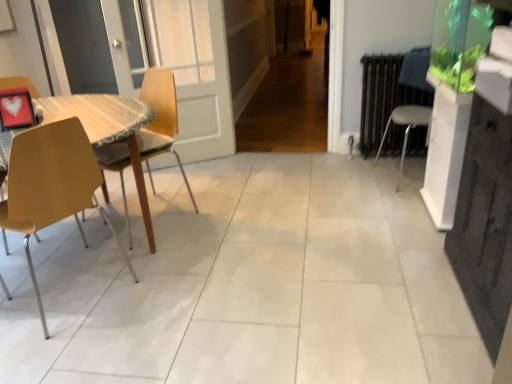
At what (x,y) coordinates should I click in order to perform the action: click on wooden at left, the 2th chair in the left-to-right sequence. Please return your answer as a coordinate pair (x, y). The width and height of the screenshot is (512, 384). Looking at the image, I should click on (160, 120).

At what (x,y) coordinates should I click in order to perform the action: click on wooden at left, the 2th chair in the left-to-right sequence. Please return your answer as a coordinate pair (x, y). This screenshot has width=512, height=384. Looking at the image, I should click on (160, 120).

From a real-world perspective, relative to wooden at left, arranged as the second chair when viewed from the right, is matte yellow chair at left, the 3th chair viewed from the right, vertically above or below?

matte yellow chair at left, the 3th chair viewed from the right, is situated higher than wooden at left, arranged as the second chair when viewed from the right, in the real world.

How different are the orientations of matte yellow chair at left, the 3th chair viewed from the right, and wooden at left, the 2th chair in the left-to-right sequence, in degrees?

They differ by 85.2 degrees in their facing directions.

Is matte yellow chair at left, placed as the 1th chair when sorted from left to right, smaller than wooden at left, the 2th chair in the left-to-right sequence?

Correct, matte yellow chair at left, placed as the 1th chair when sorted from left to right, occupies less space than wooden at left, the 2th chair in the left-to-right sequence.

Is matte yellow chair at left, the 3th chair viewed from the right, spatially inside wooden at left, arranged as the second chair when viewed from the right, or outside of it?

matte yellow chair at left, the 3th chair viewed from the right, lies outside wooden at left, arranged as the second chair when viewed from the right.

From a real-world perspective, is matte yellow chair at left, the 3th chair viewed from the right, beneath white plastic chair at right, arranged as the 1th chair when viewed from the right?

No, from a real-world perspective, matte yellow chair at left, the 3th chair viewed from the right, is not below white plastic chair at right, arranged as the 1th chair when viewed from the right.

Who is taller, matte yellow chair at left, placed as the 1th chair when sorted from left to right, or white plastic chair at right, arranged as the 1th chair when viewed from the right?

matte yellow chair at left, placed as the 1th chair when sorted from left to right, is taller.

There is a matte yellow chair at left, the 3th chair viewed from the right. Where is `the 2nd chair above it (from the image's perspective)`? The height and width of the screenshot is (384, 512). the 2nd chair above it (from the image's perspective) is located at coordinates (407, 126).

Between matte yellow chair at left, the 3th chair viewed from the right, and white plastic chair at right, arranged as the 3th chair when viewed from the left, which one appears on the right side from the viewer's perspective?

white plastic chair at right, arranged as the 3th chair when viewed from the left, is more to the right.

Which object is wider, wooden at left, arranged as the second chair when viewed from the right, or matte yellow chair at left, placed as the 1th chair when sorted from left to right?

wooden at left, arranged as the second chair when viewed from the right.

Could matte yellow chair at left, placed as the 1th chair when sorted from left to right, be considered to be inside wooden at left, arranged as the second chair when viewed from the right?

That's incorrect, matte yellow chair at left, placed as the 1th chair when sorted from left to right, is not inside wooden at left, arranged as the second chair when viewed from the right.

From the image's perspective, does wooden at left, arranged as the second chair when viewed from the right, appear lower than matte yellow chair at left, placed as the 1th chair when sorted from left to right?

No, from the image's perspective, wooden at left, arranged as the second chair when viewed from the right, is not below matte yellow chair at left, placed as the 1th chair when sorted from left to right.

Is wooden at left, arranged as the second chair when viewed from the right, with white plastic chair at right, arranged as the 3th chair when viewed from the left?

No, wooden at left, arranged as the second chair when viewed from the right, is not making contact with white plastic chair at right, arranged as the 3th chair when viewed from the left.

Considering the sizes of objects wooden at left, arranged as the second chair when viewed from the right, and white plastic chair at right, arranged as the 1th chair when viewed from the right, in the image provided, who is taller, wooden at left, arranged as the second chair when viewed from the right, or white plastic chair at right, arranged as the 1th chair when viewed from the right,?

With more height is wooden at left, arranged as the second chair when viewed from the right.

Can you confirm if wooden at left, the 2th chair in the left-to-right sequence, is wider than white plastic chair at right, arranged as the 3th chair when viewed from the left?

Incorrect, the width of wooden at left, the 2th chair in the left-to-right sequence, does not surpass that of white plastic chair at right, arranged as the 3th chair when viewed from the left.

Does point (146, 96) appear closer or farther from the camera than point (400, 167)?

Point (146, 96) is closer to the camera than point (400, 167).

Is white plastic chair at right, arranged as the 1th chair when viewed from the right, positioned in front of matte yellow chair at left, the 3th chair viewed from the right?

No, white plastic chair at right, arranged as the 1th chair when viewed from the right, is further to the viewer.

From the picture: Which of these two, white plastic chair at right, arranged as the 3th chair when viewed from the left, or matte yellow chair at left, placed as the 1th chair when sorted from left to right, is wider?

Wider between the two is white plastic chair at right, arranged as the 3th chair when viewed from the left.

From a real-world perspective, is white plastic chair at right, arranged as the 3th chair when viewed from the left, positioned above or below matte yellow chair at left, placed as the 1th chair when sorted from left to right?

white plastic chair at right, arranged as the 3th chair when viewed from the left, is situated lower than matte yellow chair at left, placed as the 1th chair when sorted from left to right, in the real world.

Locate an element on the screen. the 2nd chair behind the matte yellow chair at left, placed as the 1th chair when sorted from left to right is located at coordinates (407, 126).

Does white plastic chair at right, arranged as the 3th chair when viewed from the left, turn towards wooden at left, the 2th chair in the left-to-right sequence?

A: Yes, white plastic chair at right, arranged as the 3th chair when viewed from the left, is oriented towards wooden at left, the 2th chair in the left-to-right sequence.

Considering the positions of point (415, 106) and point (176, 131), is point (415, 106) closer or farther from the camera than point (176, 131)?

Clearly, point (415, 106) is closer to the camera than point (176, 131).

Considering the sizes of objects white plastic chair at right, arranged as the 3th chair when viewed from the left, and wooden at left, arranged as the second chair when viewed from the right, in the image provided, who is wider, white plastic chair at right, arranged as the 3th chair when viewed from the left, or wooden at left, arranged as the second chair when viewed from the right,?

white plastic chair at right, arranged as the 3th chair when viewed from the left, is wider.

You are a GUI agent. You are given a task and a screenshot of the screen. Output one action in this format:
    pyautogui.click(x=<x>, y=<y>)
    Task: Click on the 1st chair positioned above the matte yellow chair at left, the 3th chair viewed from the right (from the image's perspective)
    This screenshot has width=512, height=384.
    Given the screenshot: What is the action you would take?
    pyautogui.click(x=160, y=120)

The width and height of the screenshot is (512, 384). In order to click on the 2nd chair to the left of the white plastic chair at right, arranged as the 3th chair when viewed from the left, counting from the anchor's position in this screenshot , I will do `click(51, 185)`.

Which object lies further to the anchor point white plastic chair at right, arranged as the 3th chair when viewed from the left, matte yellow chair at left, the 3th chair viewed from the right, or wooden at left, the 2th chair in the left-to-right sequence?

matte yellow chair at left, the 3th chair viewed from the right, is positioned further to the anchor white plastic chair at right, arranged as the 3th chair when viewed from the left.

Which object lies further to the anchor point matte yellow chair at left, the 3th chair viewed from the right, white plastic chair at right, arranged as the 1th chair when viewed from the right, or wooden at left, arranged as the second chair when viewed from the right?

Based on the image, white plastic chair at right, arranged as the 1th chair when viewed from the right, appears to be further to matte yellow chair at left, the 3th chair viewed from the right.

Looking at the image, which one is located closer to wooden at left, the 2th chair in the left-to-right sequence, matte yellow chair at left, the 3th chair viewed from the right, or white plastic chair at right, arranged as the 1th chair when viewed from the right?

matte yellow chair at left, the 3th chair viewed from the right.

Estimate the real-world distances between objects in this image. Which object is closer to matte yellow chair at left, the 3th chair viewed from the right, wooden at left, the 2th chair in the left-to-right sequence, or white plastic chair at right, arranged as the 1th chair when viewed from the right?

wooden at left, the 2th chair in the left-to-right sequence, is closer to matte yellow chair at left, the 3th chair viewed from the right.

Based on their spatial positions, is white plastic chair at right, arranged as the 3th chair when viewed from the left, or matte yellow chair at left, the 3th chair viewed from the right, further from wooden at left, arranged as the second chair when viewed from the right?

white plastic chair at right, arranged as the 3th chair when viewed from the left, is further to wooden at left, arranged as the second chair when viewed from the right.

Which object lies nearer to the anchor point white plastic chair at right, arranged as the 3th chair when viewed from the left, wooden at left, the 2th chair in the left-to-right sequence, or matte yellow chair at left, placed as the 1th chair when sorted from left to right?

Among the two, wooden at left, the 2th chair in the left-to-right sequence, is located nearer to white plastic chair at right, arranged as the 3th chair when viewed from the left.

In order to click on chair between matte yellow chair at left, the 3th chair viewed from the right, and white plastic chair at right, arranged as the 3th chair when viewed from the left in this screenshot , I will do `click(160, 120)`.